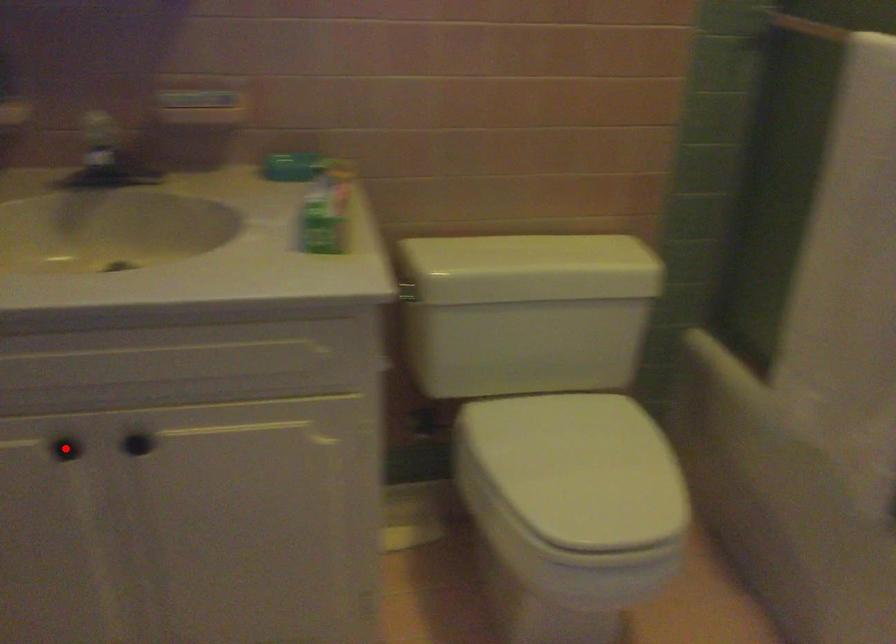
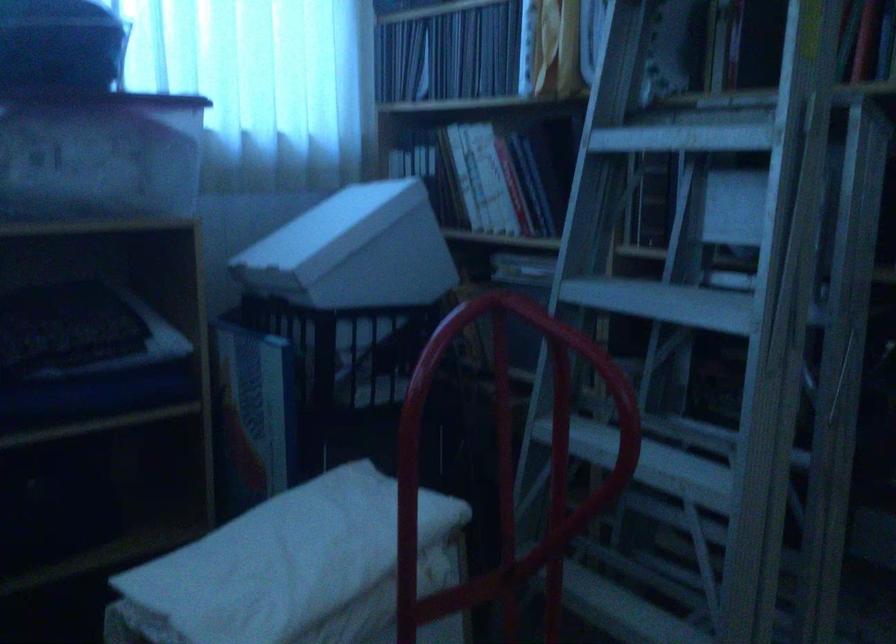
Question: I am providing you with two images of the same scene from different viewpoints. A red point is marked on the first image. Is the red point's position out of view in image 2?

Choices:
 (A) Yes
 (B) No

Answer: (A)